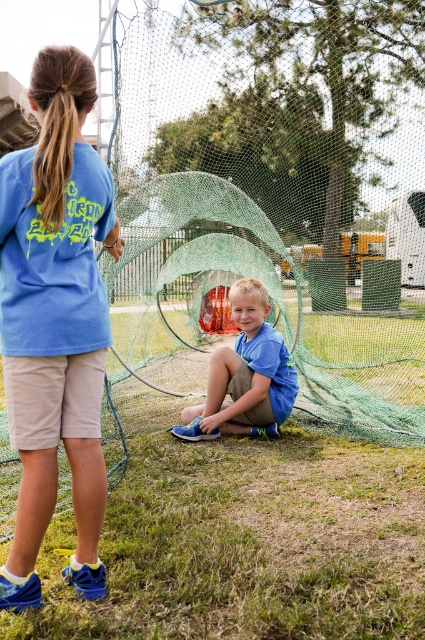
Is green mesh fishing net at center to the right of blue cotton shirt at upper left from the viewer's perspective?

Indeed, green mesh fishing net at center is positioned on the right side of blue cotton shirt at upper left.

Is green mesh fishing net at center shorter than blue cotton shirt at upper left?

No, green mesh fishing net at center is not shorter than blue cotton shirt at upper left.

Measure the distance between point [410,211] and camera.

A distance of 15.46 meters exists between point [410,211] and camera.

At what (x,y) coordinates should I click in order to perform the action: click on green mesh fishing net at center. Please return your answer as a coordinate pair (x, y). The height and width of the screenshot is (640, 425). Looking at the image, I should click on (255, 237).

What do you see at coordinates (255, 237) in the screenshot? I see `green mesh fishing net at center` at bounding box center [255, 237].

Is green mesh fishing net at center positioned in front of blue cotton shirt at center?

Yes.

Which is behind, point (133, 26) or point (221, 412)?

Positioned behind is point (221, 412).

You are a GUI agent. You are given a task and a screenshot of the screen. Output one action in this format:
    pyautogui.click(x=<x>, y=<y>)
    Task: Click on the green mesh fishing net at center
    The image size is (425, 640).
    Given the screenshot: What is the action you would take?
    pyautogui.click(x=255, y=237)

In the scene shown: Between blue cotton shirt at upper left and blue cotton shirt at center, which one appears on the left side from the viewer's perspective?

blue cotton shirt at upper left

Does point (22, 540) come farther from viewer compared to point (212, 433)?

No, it is in front of (212, 433).

Image resolution: width=425 pixels, height=640 pixels. Identify the location of blue cotton shirt at upper left. (56, 321).